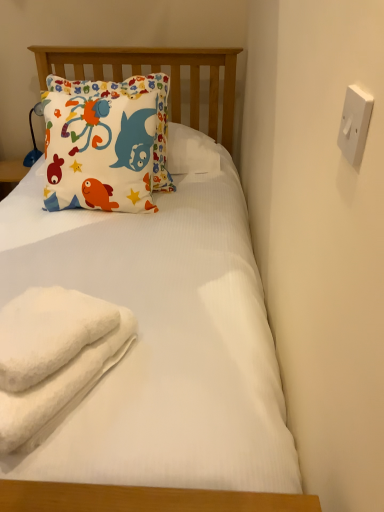
Where is `white fluffy beach towel at lower left`? The image size is (384, 512). white fluffy beach towel at lower left is located at coordinates (60, 390).

Image resolution: width=384 pixels, height=512 pixels. In order to click on matte cotton pillow at upper left in this screenshot , I will do `click(106, 143)`.

I want to click on white plastic switch at upper right, so click(x=355, y=124).

How different are the orientations of matte cotton pillow at upper left and white plastic switch at upper right in degrees?

They differ by 82.2 degrees in their facing directions.

Is matte cotton pillow at upper left aimed at white plastic switch at upper right?

No, matte cotton pillow at upper left does not turn towards white plastic switch at upper right.

Is matte cotton pillow at upper left next to white plastic switch at upper right and touching it?

No, matte cotton pillow at upper left is not making contact with white plastic switch at upper right.

From a real-world perspective, which is physically below, matte cotton pillow at upper left or white plastic switch at upper right?

matte cotton pillow at upper left is physically lower.

Can white fluffy beach towel at lower left be found inside white fluffy towel at lower left?

Definitely not — white fluffy beach towel at lower left is not inside white fluffy towel at lower left.

The height and width of the screenshot is (512, 384). What are the coordinates of `beach towel below the white fluffy towel at lower left (from a real-world perspective)` in the screenshot? It's located at (60, 390).

In terms of size, does white fluffy towel at lower left appear bigger or smaller than white fluffy beach towel at lower left?

In the image, white fluffy towel at lower left appears to be smaller than white fluffy beach towel at lower left.

Is white fluffy towel at lower left positioned far away from white fluffy beach towel at lower left?

They are positioned close to each other.

Is white plastic switch at upper right far from matte cotton pillow at upper left?

No, white plastic switch at upper right is not far from matte cotton pillow at upper left.

Considering the positions of point (363, 142) and point (95, 144), is point (363, 142) closer or farther from the camera than point (95, 144)?

Clearly, point (363, 142) is closer to the camera than point (95, 144).

From the picture: Is white plastic switch at upper right bigger or smaller than matte cotton pillow at upper left?

white plastic switch at upper right is smaller than matte cotton pillow at upper left.

Which is more to the left, white plastic switch at upper right or matte cotton pillow at upper left?

matte cotton pillow at upper left is more to the left.

From a real-world perspective, is white fluffy beach towel at lower left positioned over white plastic switch at upper right based on gravity?

No, from a real-world perspective, white fluffy beach towel at lower left is not on top of white plastic switch at upper right.

Consider the image. Is white fluffy beach towel at lower left inside or outside of white plastic switch at upper right?

white fluffy beach towel at lower left is located beyond the bounds of white plastic switch at upper right.

From the image's perspective, who appears lower, white fluffy beach towel at lower left or white plastic switch at upper right?

From the image's view, white fluffy beach towel at lower left is below.

How distant is white fluffy beach towel at lower left from white fluffy towel at lower left?

6.79 centimeters.

From a real-world perspective, is white fluffy beach towel at lower left over white fluffy towel at lower left?

No, from a real-world perspective, white fluffy beach towel at lower left is not over white fluffy towel at lower left

Which point is more forward, (7, 436) or (51, 331)?

The point (7, 436) is more forward.

Is white fluffy beach towel at lower left in front of white fluffy towel at lower left?

That is True.

Are matte cotton pillow at upper left and white fluffy beach towel at lower left making contact?

matte cotton pillow at upper left and white fluffy beach towel at lower left are not in contact.

How distant is matte cotton pillow at upper left from white fluffy beach towel at lower left?

35.32 inches.

From the image's perspective, which one is positioned lower, matte cotton pillow at upper left or white fluffy beach towel at lower left?

white fluffy beach towel at lower left is shown below in the image.

How different are the orientations of matte cotton pillow at upper left and white fluffy beach towel at lower left in degrees?

There is a 16.8-degree angle between the facing directions of matte cotton pillow at upper left and white fluffy beach towel at lower left.

Is point (10, 388) positioned in front of point (48, 163)?

Yes, point (10, 388) is in front of point (48, 163).

Is white fluffy towel at lower left positioned before matte cotton pillow at upper left?

Yes, it is in front of matte cotton pillow at upper left.

In the scene shown: From the image's perspective, between white fluffy towel at lower left and matte cotton pillow at upper left, who is located below?

white fluffy towel at lower left.

Which of these two, white fluffy towel at lower left or matte cotton pillow at upper left, is smaller?

With smaller size is white fluffy towel at lower left.

Locate an element on the screen. pillow above the white plastic switch at upper right (from the image's perspective) is located at coordinates point(106,143).

There is a white fluffy beach towel at lower left. Identify the location of towel above it (from a real-world perspective). (48, 332).

When comparing their distances from white plastic switch at upper right, does matte cotton pillow at upper left or white fluffy towel at lower left seem closer?

Among the two, white fluffy towel at lower left is located nearer to white plastic switch at upper right.

From the image, which object appears to be nearer to matte cotton pillow at upper left, white fluffy towel at lower left or white fluffy beach towel at lower left?

The object closer to matte cotton pillow at upper left is white fluffy towel at lower left.

Estimate the real-world distances between objects in this image. Which object is further from white fluffy towel at lower left, matte cotton pillow at upper left or white fluffy beach towel at lower left?

matte cotton pillow at upper left is positioned further to the anchor white fluffy towel at lower left.

When comparing their distances from matte cotton pillow at upper left, does white plastic switch at upper right or white fluffy beach towel at lower left seem closer?

The object closer to matte cotton pillow at upper left is white plastic switch at upper right.

Which object lies nearer to the anchor point white plastic switch at upper right, white fluffy towel at lower left or white fluffy beach towel at lower left?

white fluffy towel at lower left.

Looking at the image, which one is located closer to white fluffy towel at lower left, matte cotton pillow at upper left or white plastic switch at upper right?

white plastic switch at upper right lies closer to white fluffy towel at lower left than the other object.

Estimate the real-world distances between objects in this image. Which object is closer to matte cotton pillow at upper left, white plastic switch at upper right or white fluffy towel at lower left?

Among the two, white fluffy towel at lower left is located nearer to matte cotton pillow at upper left.

Considering their positions, is white plastic switch at upper right positioned closer to white fluffy towel at lower left than matte cotton pillow at upper left?

The object closer to white fluffy towel at lower left is white plastic switch at upper right.

Identify the location of towel positioned between white plastic switch at upper right and matte cotton pillow at upper left from near to far. (48, 332).

I want to click on beach towel between white plastic switch at upper right and matte cotton pillow at upper left from front to back, so click(x=60, y=390).

You are a GUI agent. You are given a task and a screenshot of the screen. Output one action in this format:
    pyautogui.click(x=<x>, y=<y>)
    Task: Click on the towel between white fluffy beach towel at lower left and matte cotton pillow at upper left from front to back
    
    Given the screenshot: What is the action you would take?
    pyautogui.click(x=48, y=332)

Where is `towel between white fluffy beach towel at lower left and white plastic switch at upper right`? towel between white fluffy beach towel at lower left and white plastic switch at upper right is located at coordinates (48, 332).